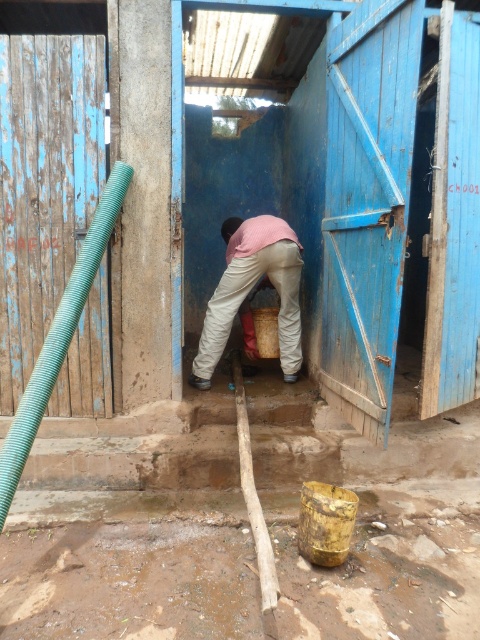
Is brown clay mud at lower center positioned before pink fabric at center?

Yes, brown clay mud at lower center is in front of pink fabric at center.

Between point (96, 609) and point (273, 243), which one is positioned in front?

Positioned in front is point (96, 609).

Identify the location of brown clay mud at lower center. (130, 580).

Between brown clay mud at lower center and green corrugated pipe at left, which one appears on the left side from the viewer's perspective?

From the viewer's perspective, green corrugated pipe at left appears more on the left side.

From the picture: Which of these two, brown clay mud at lower center or green corrugated pipe at left, stands shorter?

Standing shorter between the two is brown clay mud at lower center.

You are a GUI agent. You are given a task and a screenshot of the screen. Output one action in this format:
    pyautogui.click(x=<x>, y=<y>)
    Task: Click on the brown clay mud at lower center
    The width and height of the screenshot is (480, 640).
    Given the screenshot: What is the action you would take?
    pyautogui.click(x=130, y=580)

At what (x,y) coordinates should I click in order to perform the action: click on brown clay mud at lower center. Please return your answer as a coordinate pair (x, y). Looking at the image, I should click on (130, 580).

Image resolution: width=480 pixels, height=640 pixels. Describe the element at coordinates (251, 289) in the screenshot. I see `pink fabric at center` at that location.

At what (x,y) coordinates should I click in order to perform the action: click on pink fabric at center. Please return your answer as a coordinate pair (x, y). Image resolution: width=480 pixels, height=640 pixels. Looking at the image, I should click on (251, 289).

At what (x,y) coordinates should I click in order to perform the action: click on pink fabric at center. Please return your answer as a coordinate pair (x, y). Looking at the image, I should click on (251, 289).